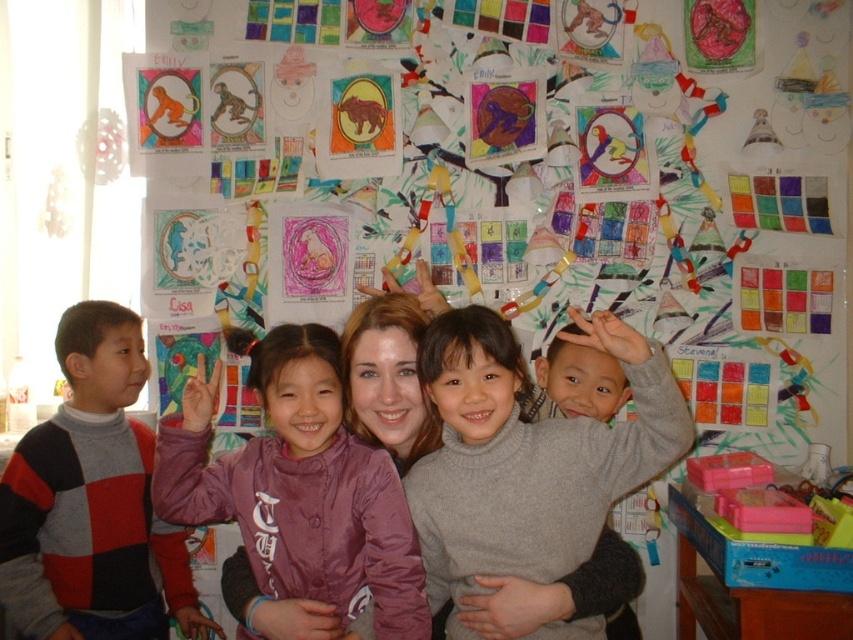
Question: Which of the following is the farthest from the observer?

Choices:
 (A) striped sweater at left
 (B) purple satin jacket at center
 (C) gray wool sweater at center

Answer: (A)

Question: Which is nearer to the purple satin jacket at center?

Choices:
 (A) gray wool sweater at center
 (B) striped sweater at left

Answer: (A)

Question: Does gray wool sweater at center have a larger size compared to striped sweater at left?

Choices:
 (A) no
 (B) yes

Answer: (A)

Question: Which point is farther from the camera taking this photo?

Choices:
 (A) (283, 595)
 (B) (33, 628)
 (C) (547, 515)

Answer: (B)

Question: In this image, where is gray wool sweater at center located relative to purple satin jacket at center?

Choices:
 (A) left
 (B) right

Answer: (B)

Question: Is gray wool sweater at center below purple satin jacket at center?

Choices:
 (A) yes
 (B) no

Answer: (B)